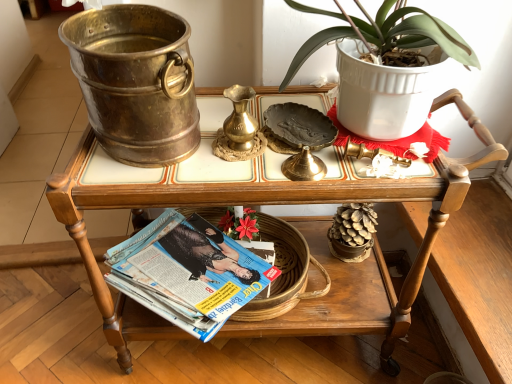
You are a GUI agent. You are given a task and a screenshot of the screen. Output one action in this format:
    pyautogui.click(x=<x>, y=<y>)
    Task: Click on the free space above matte paper magazine at lower center (from a real-world perspective)
    
    Given the screenshot: What is the action you would take?
    pyautogui.click(x=205, y=258)